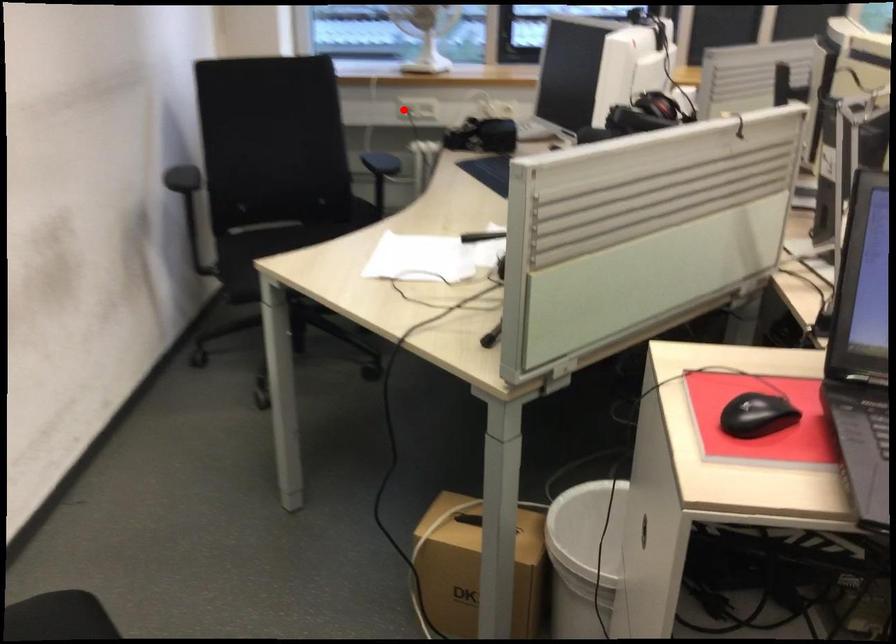
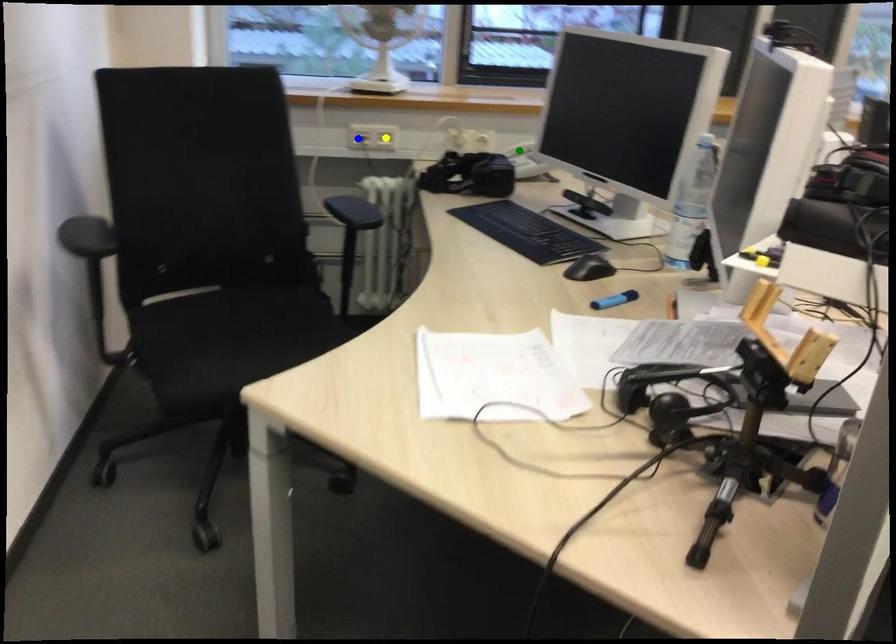
Question: I am providing you with two images of the same scene from different viewpoints. A red point is marked on the first image. You are given multiple points on the second image. Which mark in image 2 goes with the point in image 1?

Choices:
 (A) blue point
 (B) green point
 (C) yellow point

Answer: (A)